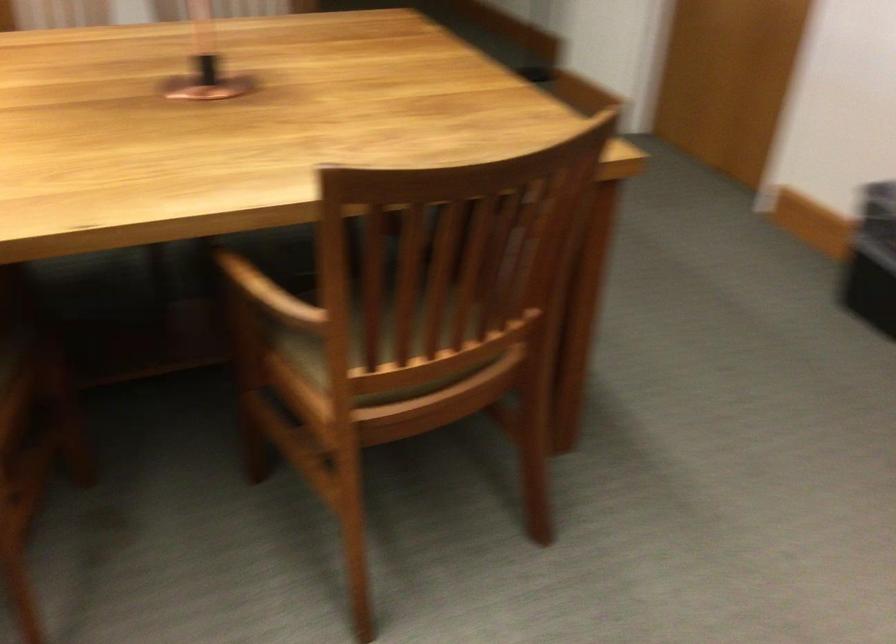
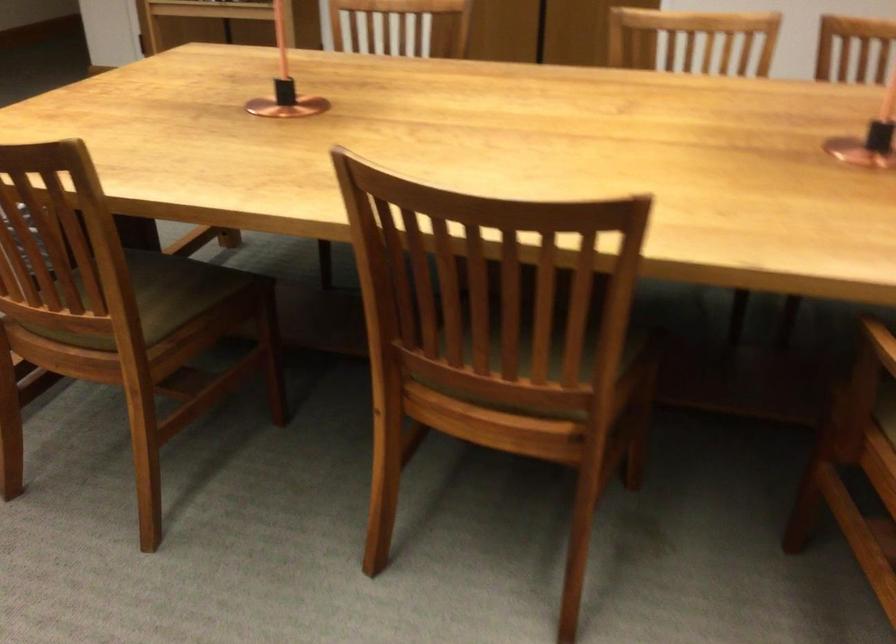
Locate, in the second image, the point that corresponds to the point at 208,78 in the first image.

(869, 137)